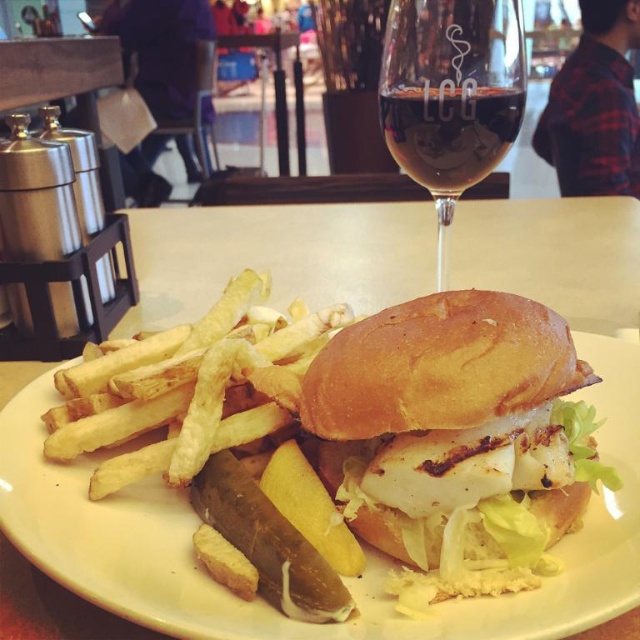
You are a food critic evaluating the presentation of this meal. The white bread bun at center and the transparent glass wine at upper center are both on the plate. Which object takes up more space on the plate?

The transparent glass wine at upper center takes up more space on the plate than the white bread bun at center because it is larger in size.

You are a delivery robot standing at point (611,548), and you need to deliver a small package to the table where the meal is placed. The table is 1.2 meters away from you. Can you reach the table from your current position?

The distance between point (611,548) and the viewer is 51.31 centimeters. Since the table is 1.2 meters away, you are closer to the table than the distance provided. However, the given information only specifies the distance from the point to the viewer, not the table. Without knowing the exact position of the table relative to the point, it is impossible to determine if you can reach it.